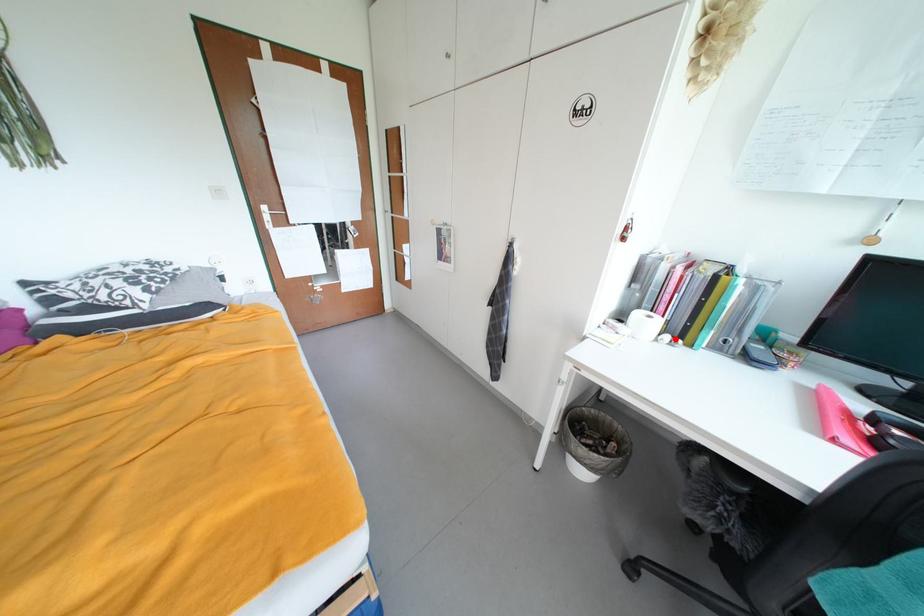
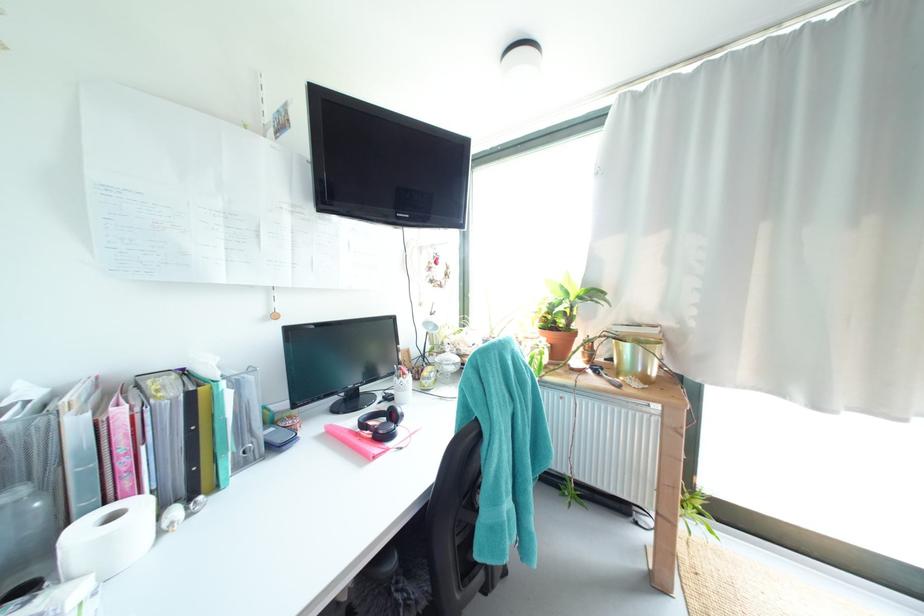
Find the pixel in the second image that matches the highlighted location in the first image.

(185, 513)